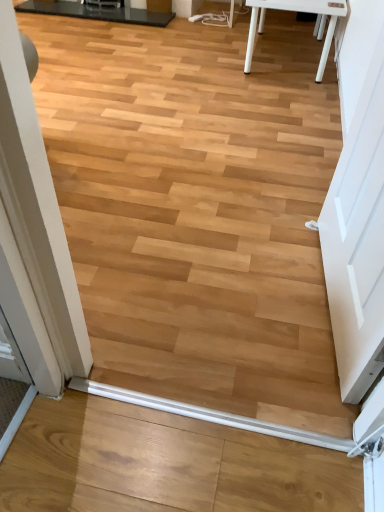
Locate an element on the screen. This screenshot has height=512, width=384. vacant space situated on the left part of white matte door at right is located at coordinates (223, 289).